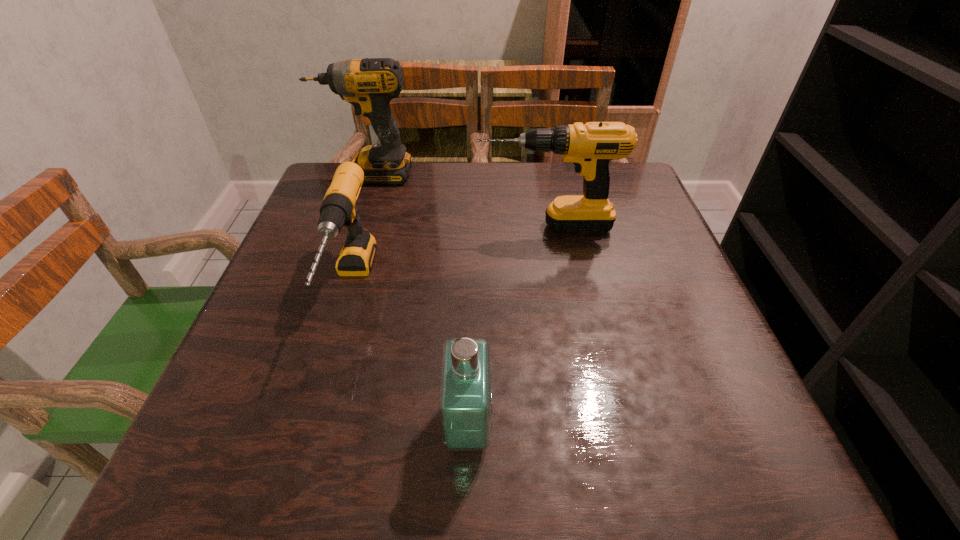
Locate an element on the screen. blank space located 0.150m on the front label of the perfume is located at coordinates pos(589,426).

The image size is (960, 540). What are the coordinates of `object located in the far edge section of the desktop` in the screenshot? It's located at (369, 85).

Identify the location of object present at the near edge. This screenshot has width=960, height=540. (465, 392).

Find the location of `object that is at the right edge`. object that is at the right edge is located at coordinates (590, 146).

You are a GUI agent. You are given a task and a screenshot of the screen. Output one action in this format:
    pyautogui.click(x=<x>, y=<y>)
    Task: Click on the object that is at the far left corner
    
    Given the screenshot: What is the action you would take?
    pyautogui.click(x=369, y=85)

The image size is (960, 540). In order to click on vacant position at the far edge of the desktop in this screenshot , I will do pos(461,194).

Locate an element on the screen. Image resolution: width=960 pixels, height=540 pixels. blank space at the near edge of the desktop is located at coordinates (454, 468).

In order to click on free space at the left edge in this screenshot , I will do `click(284, 267)`.

Where is `free space at the right edge of the desktop`? The height and width of the screenshot is (540, 960). free space at the right edge of the desktop is located at coordinates (615, 282).

Where is `blank space at the far left corner of the desktop`? The width and height of the screenshot is (960, 540). blank space at the far left corner of the desktop is located at coordinates (356, 202).